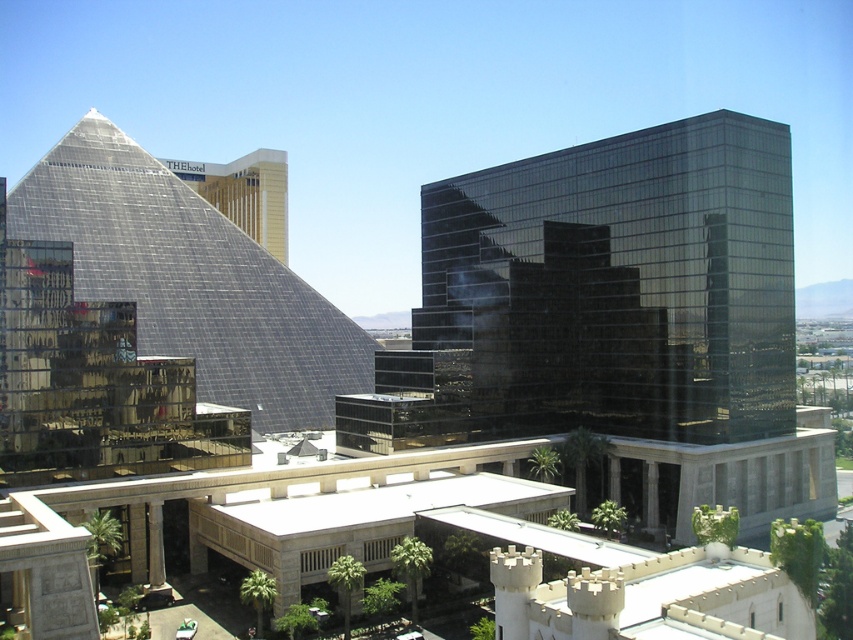
Does shiny glass building at center have a greater width compared to transparent glass pyramid at left?

No, shiny glass building at center is not wider than transparent glass pyramid at left.

Locate an element on the screen. shiny glass building at center is located at coordinates (624, 280).

The image size is (853, 640). What are the coordinates of `shiny glass building at center` in the screenshot? It's located at (624, 280).

This screenshot has height=640, width=853. Identify the location of shiny glass building at center. (624, 280).

Who is shorter, transparent glass pyramid at left or gold reflective hotel at upper left?

With less height is gold reflective hotel at upper left.

The height and width of the screenshot is (640, 853). What do you see at coordinates (190, 280) in the screenshot? I see `transparent glass pyramid at left` at bounding box center [190, 280].

Identify the location of transparent glass pyramid at left. (190, 280).

Does shiny glass building at center come behind gold reflective hotel at upper left?

No.

Image resolution: width=853 pixels, height=640 pixels. I want to click on shiny glass building at center, so click(624, 280).